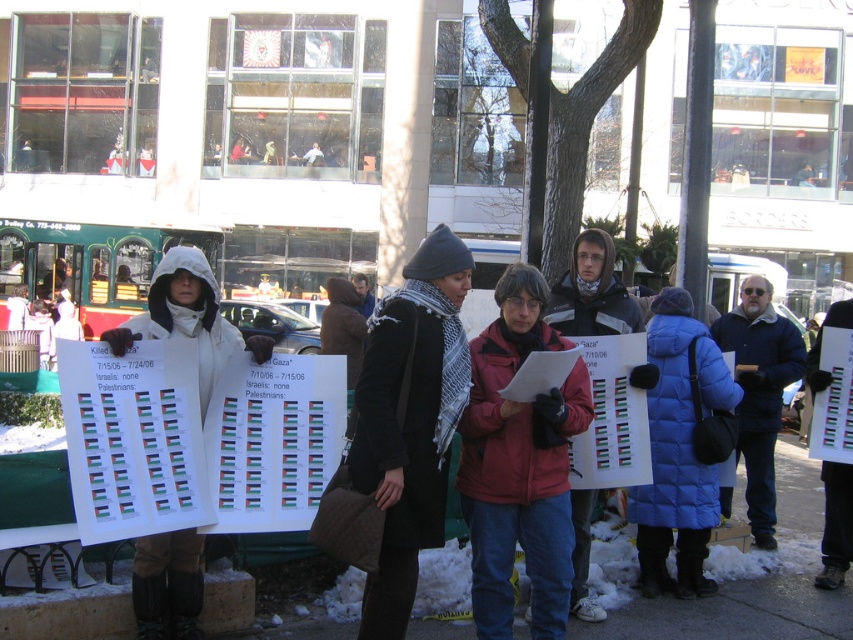
You are a photographer trying to capture a clear shot of both the blue down jacket at center and the white fleece jacket at center. Since you want to ensure both are fully visible in the frame, which jacket should you focus on to account for their sizes?

The blue down jacket at center is taller than the white fleece jacket at center, so focusing on the blue down jacket at center ensures the entire height of both jackets will be captured in the frame.

You are a photographer standing at the center of the protest scene. You want to take a photo of the blue down jacket at center. Where should you aim your camera to capture the point at coordinates point (682, 448)?

The point at coordinates point (682, 448) is located on the blue down jacket at center, so aim your camera at the blue down jacket at center to capture that point.